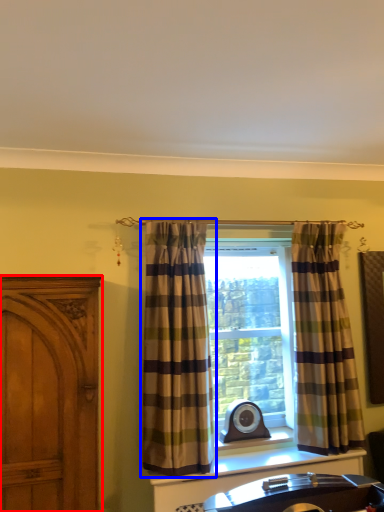
Question: Which object appears closest to the camera in this image, cabinetry (highlighted by a red box) or curtain (highlighted by a blue box)?

Choices:
 (A) cabinetry
 (B) curtain

Answer: (A)